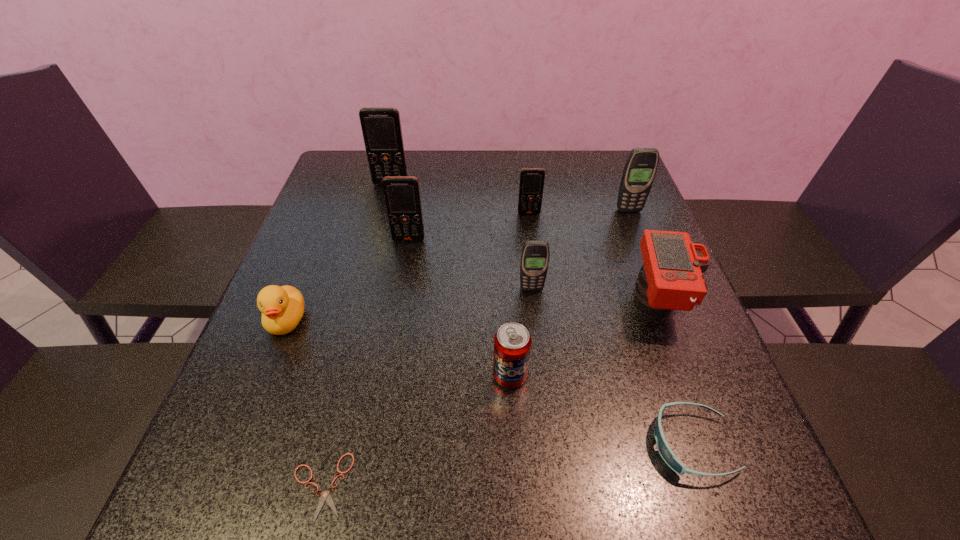
The height and width of the screenshot is (540, 960). I want to click on empty location between the soda can and the seventh nearest object, so click(459, 308).

Identify the location of vacant space that's between the nearest orange cellular telephone and the third shortest object. This screenshot has width=960, height=540. point(348,280).

This screenshot has width=960, height=540. I want to click on vacant space in between the leftmost object and the right gray cellular telephone, so click(x=458, y=265).

I want to click on unoccupied area between the goggles and the right gray cellular telephone, so click(x=660, y=327).

Select which object is the ninth closest to the farther gray cellular telephone. Please provide its 2D coordinates. Your answer should be formatted as a tuple, i.e. [(x, y)], where the tuple contains the x and y coordinates of a point satisfying the conditions above.

[(325, 496)]

In order to click on object that ranks as the seventh closest to the smallest orange cellular telephone in this screenshot , I will do `click(282, 308)`.

Identify which cellular telephone is the second closest to the right gray cellular telephone. Please provide its 2D coordinates. Your answer should be formatted as a tuple, i.e. [(x, y)], where the tuple contains the x and y coordinates of a point satisfying the conditions above.

[(535, 254)]

Identify the location of cellular telephone that is the fifth closest to the shortest object. (640, 168).

Locate an element on the screen. The image size is (960, 540). the second closest orange cellular telephone to the bigger gray cellular telephone is located at coordinates (402, 198).

Choose which orange cellular telephone is the nearest neighbor to the rightmost orange cellular telephone. Please provide its 2D coordinates. Your answer should be formatted as a tuple, i.e. [(x, y)], where the tuple contains the x and y coordinates of a point satisfying the conditions above.

[(402, 198)]